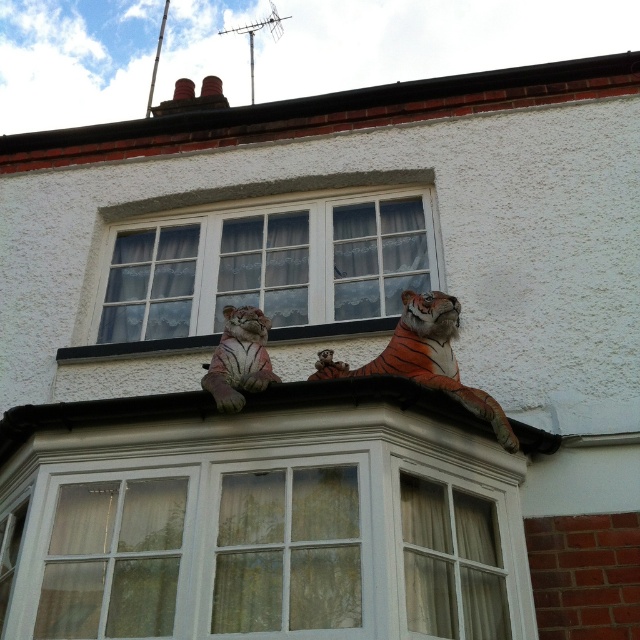
Question: Which of these objects is positioned farthest from the white textured roof at upper center?

Choices:
 (A) orange textured tiger at upper center
 (B) speckled stone tiger at center

Answer: (B)

Question: Which of the following is the closest to the observer?

Choices:
 (A) (385, 362)
 (B) (276, 376)
 (C) (349, 122)
 (D) (333, 330)

Answer: (A)

Question: Where is orange textured tiger at upper center located in relation to speckled stone tiger at center in the image?

Choices:
 (A) above
 (B) below

Answer: (A)

Question: Does white textured roof at upper center appear under orange textured tiger at upper center?

Choices:
 (A) yes
 (B) no

Answer: (B)

Question: Which of these objects is positioned closest to the orange textured tiger at upper center?

Choices:
 (A) white textured window at center
 (B) speckled stone tiger at center

Answer: (B)

Question: In this image, where is orange textured tiger at upper center located relative to speckled stone tiger at center?

Choices:
 (A) left
 (B) right

Answer: (B)